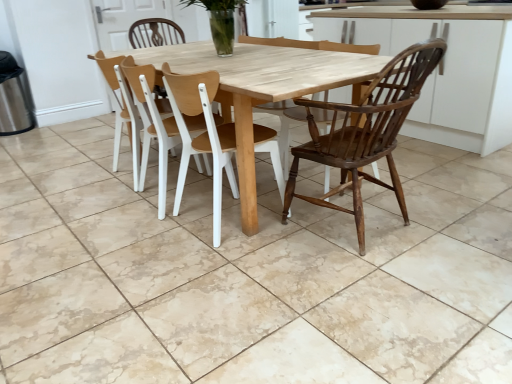
This screenshot has width=512, height=384. I want to click on free location to the left of wooden at center, which ranks as the third chair in right-to-left order, so click(x=88, y=177).